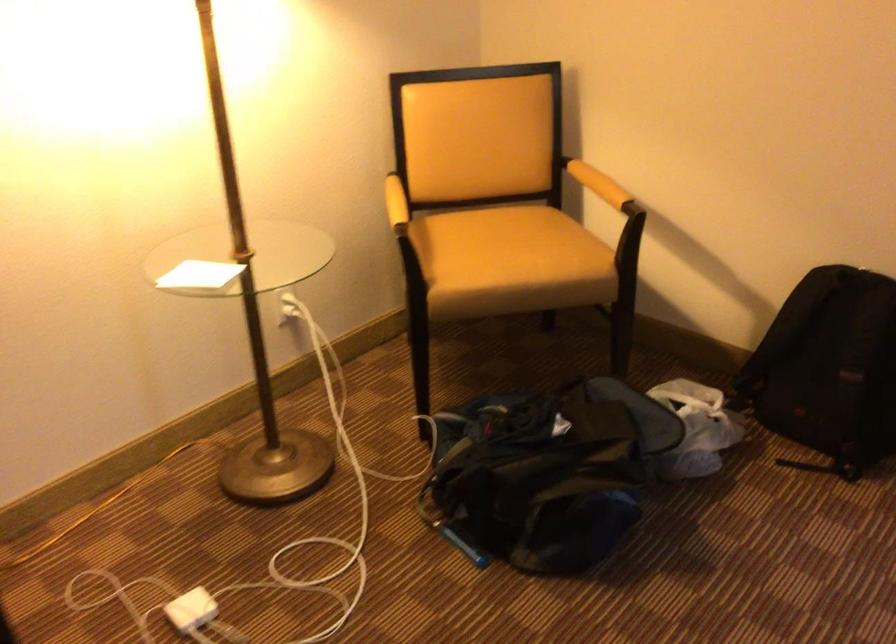
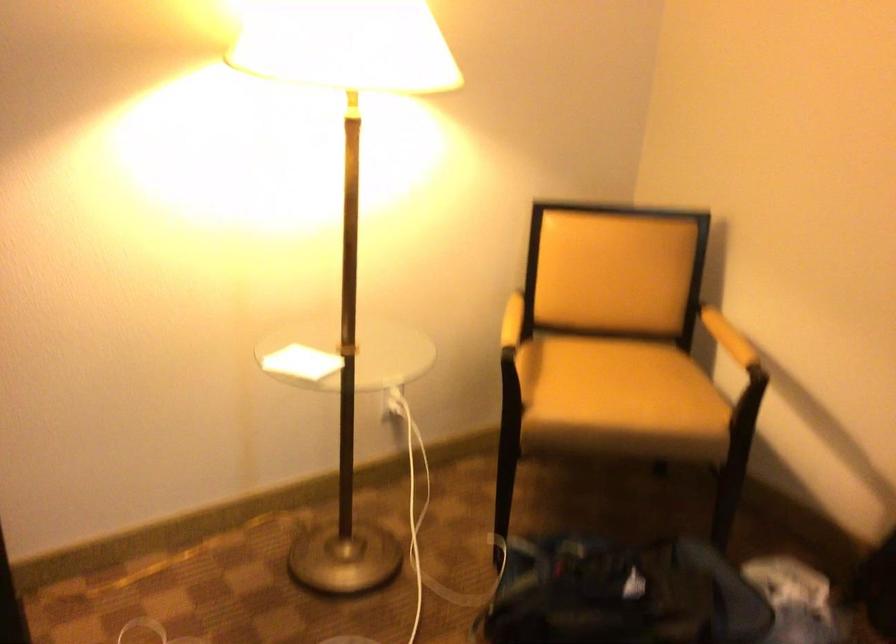
The point at (400, 203) is marked in the first image. Where is the corresponding point in the second image?

(512, 321)